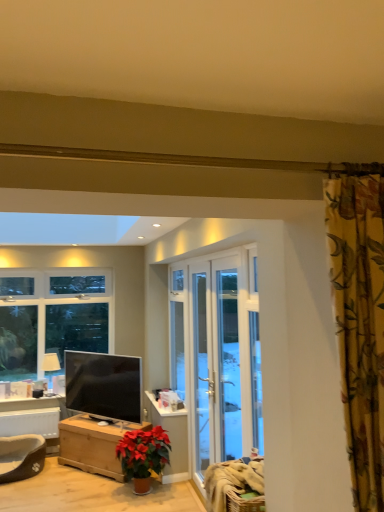
Question: Is dark brown plush pet bed at lower left taller or shorter than white glass door at center, positioned as the first screen door in back-to-front order?

Choices:
 (A) short
 (B) tall

Answer: (A)

Question: Is point (38, 440) positioned closer to the camera than point (195, 403)?

Choices:
 (A) farther
 (B) closer

Answer: (A)

Question: Estimate the real-world distances between objects in this image. Which object is closer to the matte white lamp at left?

Choices:
 (A) matte black tv at lower left
 (B) floral fabric curtain at upper right
 (C) dark brown plush pet bed at lower left
 (D) white painted wood table at lower left
 (E) wooden chest at lower left

Answer: (D)

Question: Which object is positioned closest to the wooden chest at lower left?

Choices:
 (A) dark brown plush pet bed at lower left
 (B) matte white lamp at left
 (C) white glass door at center, the 2th screen door viewed from the front
 (D) floral fabric curtain at upper right
 (E) white painted wood table at lower left

Answer: (A)